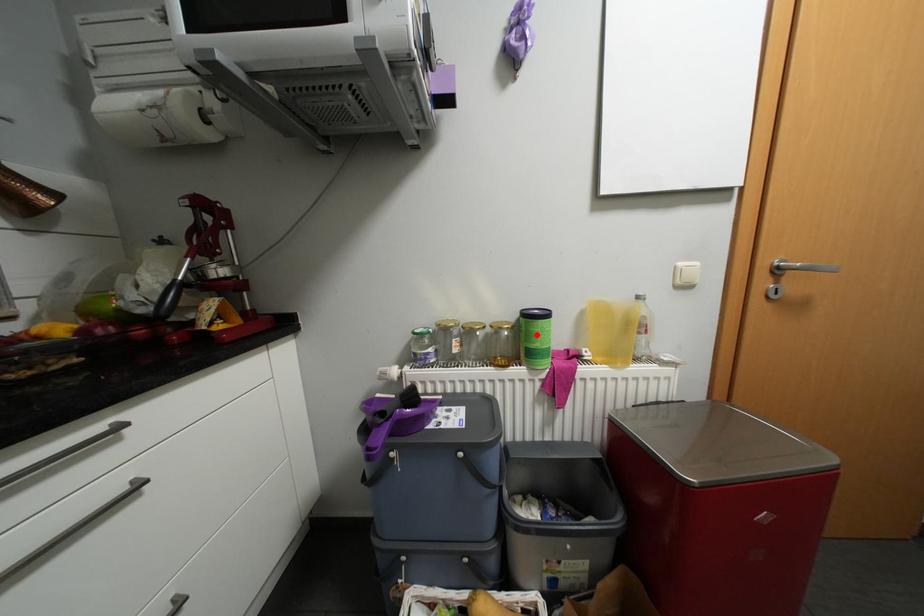
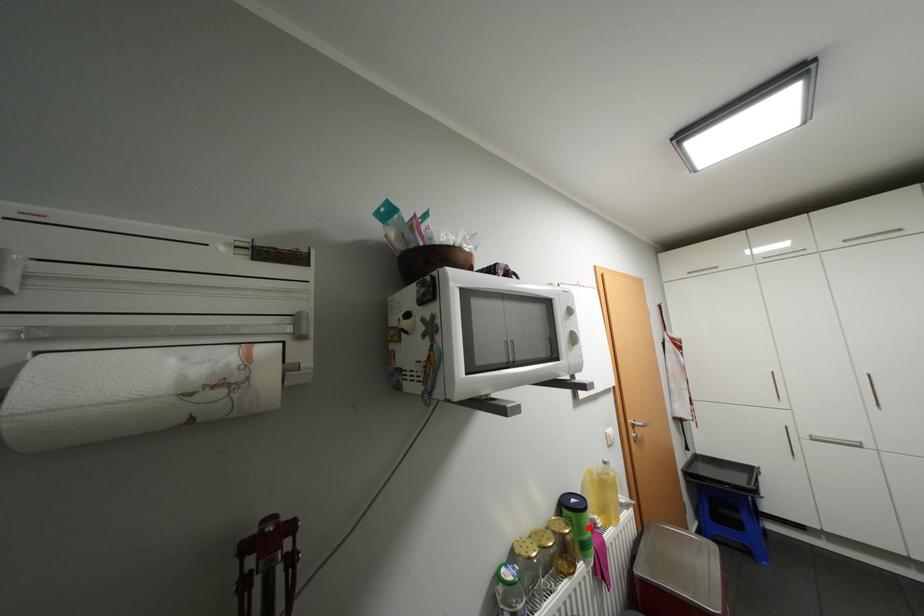
I am providing you with two images of the same scene from different viewpoints. A red point is marked on the first image and another point is marked on the second image. Is the red point in image1 aligned with the point shown in image2?

Yes